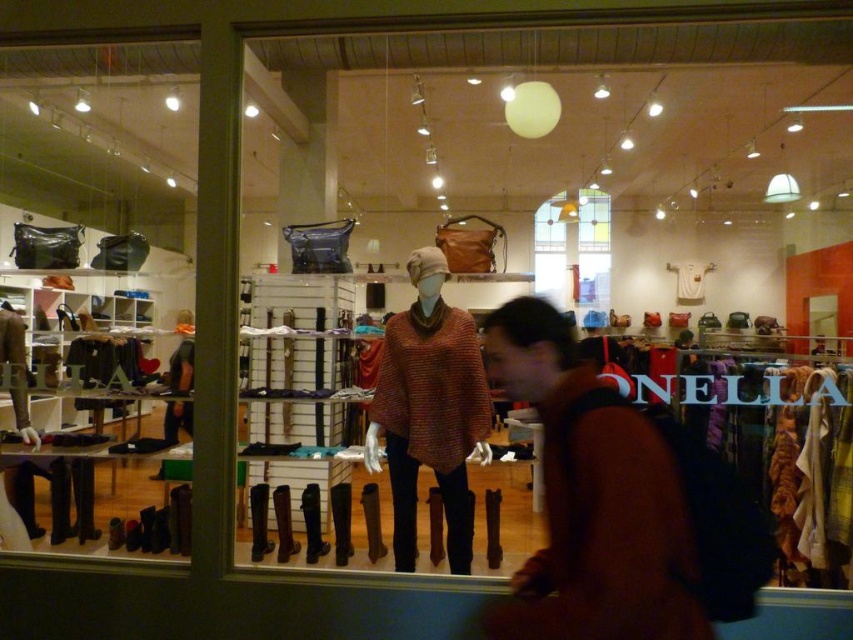
Question: Is matte black boots at lower left to the right of knitwear sweater at center from the viewer's perspective?

Choices:
 (A) no
 (B) yes

Answer: (A)

Question: Which point is farther from the camera taking this photo?

Choices:
 (A) (612, 637)
 (B) (438, 276)
 (C) (144, 532)

Answer: (C)

Question: Is brown wool sweater at center above knitwear sweater at center?

Choices:
 (A) no
 (B) yes

Answer: (A)

Question: Which object is the closest to the knitwear sweater at center?

Choices:
 (A) brown wool sweater at center
 (B) matte black boots at lower left

Answer: (A)

Question: Does brown wool sweater at center appear under knitwear sweater at center?

Choices:
 (A) yes
 (B) no

Answer: (A)

Question: Which point is closer to the camera?

Choices:
 (A) tap(103, 237)
 (B) tap(692, 618)
 (C) tap(395, 419)

Answer: (B)